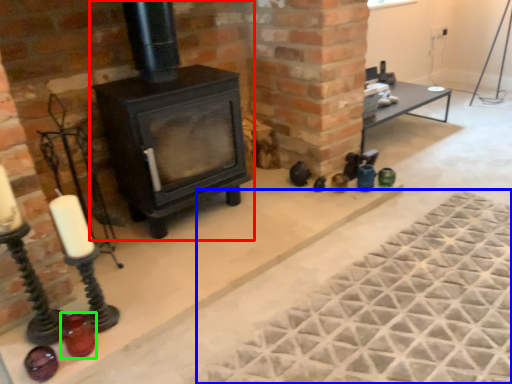
Question: Estimate the real-world distances between objects in this image. Which object is closer to wood burning stove (highlighted by a red box), mat (highlighted by a blue box) or candle holder (highlighted by a green box)?

Choices:
 (A) mat
 (B) candle holder

Answer: (B)